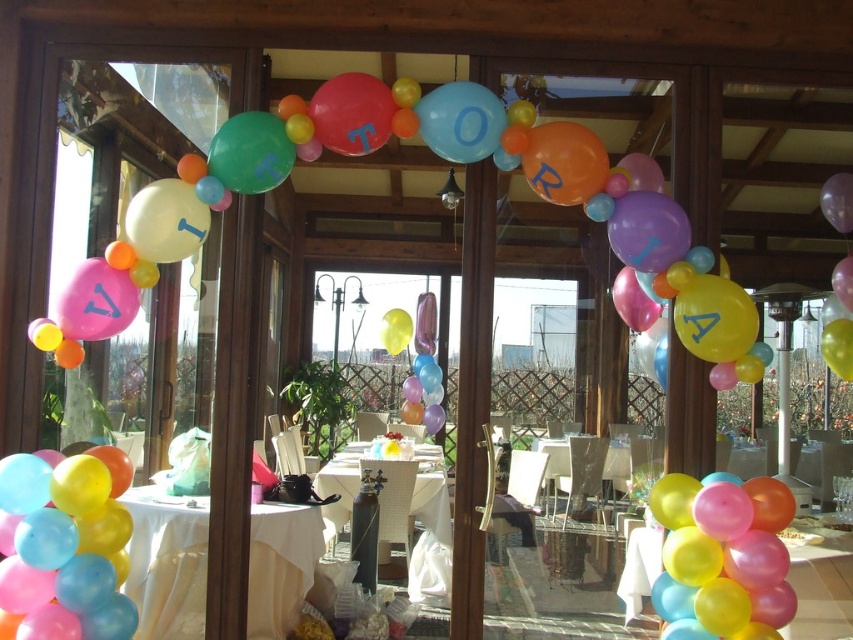
Can you confirm if pastel matte balloons at lower right is wider than white cloth table at center?

Incorrect, pastel matte balloons at lower right's width does not surpass white cloth table at center's.

Locate an element on the screen. This screenshot has width=853, height=640. pastel matte balloons at lower right is located at coordinates (722, 557).

Between translucent glossy balloon at lower left and pastel matte balloons at lower right, which one is positioned lower?

Positioned lower is pastel matte balloons at lower right.

Who is more forward, (10, 461) or (730, 500)?

Point (730, 500)

What do you see at coordinates (64, 547) in the screenshot? I see `translucent glossy balloon at lower left` at bounding box center [64, 547].

At what (x,y) coordinates should I click in order to perform the action: click on translucent glossy balloon at lower left. Please return your answer as a coordinate pair (x, y). This screenshot has width=853, height=640. Looking at the image, I should click on (64, 547).

Between translucent glossy balloon at lower left and metallic silver table at center, which one is positioned lower?

metallic silver table at center

In the scene shown: Does translucent glossy balloon at lower left appear on the left side of metallic silver table at center?

Yes, translucent glossy balloon at lower left is to the left of metallic silver table at center.

Describe the element at coordinates (64, 547) in the screenshot. I see `translucent glossy balloon at lower left` at that location.

At what (x,y) coordinates should I click in order to perform the action: click on translucent glossy balloon at lower left. Please return your answer as a coordinate pair (x, y). This screenshot has height=640, width=853. Looking at the image, I should click on (64, 547).